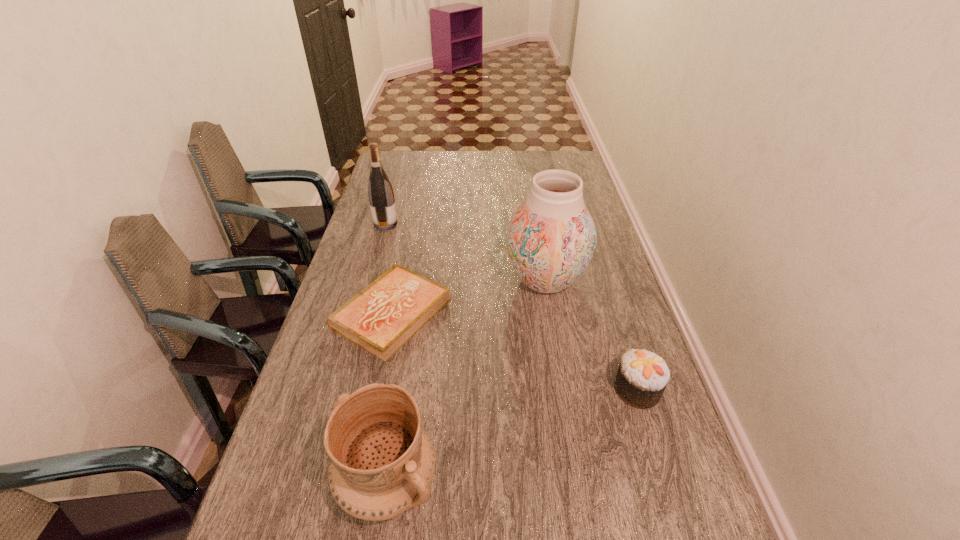
You are a GUI agent. You are given a task and a screenshot of the screen. Output one action in this format:
    pyautogui.click(x=<x>, y=<y>)
    Task: Click on the free point between the farthest object and the fourth tallest object
    Image resolution: width=960 pixels, height=540 pixels.
    Given the screenshot: What is the action you would take?
    pyautogui.click(x=512, y=307)

At what (x,y) coordinates should I click in order to perform the action: click on the fourth closest object to the vase. Please return your answer as a coordinate pair (x, y). The width and height of the screenshot is (960, 540). Looking at the image, I should click on (382, 462).

Identify which object is located as the nearest to the hardback book. Please provide its 2D coordinates. Your answer should be formatted as a tuple, i.e. [(x, y)], where the tuple contains the x and y coordinates of a point satisfying the conditions above.

[(551, 238)]

The height and width of the screenshot is (540, 960). I want to click on free space that satisfies the following two spatial constraints: 1. on the label of the wine bottle; 2. on the right side of the vase, so point(370,280).

You are a GUI agent. You are given a task and a screenshot of the screen. Output one action in this format:
    pyautogui.click(x=<x>, y=<y>)
    Task: Click on the vacant position in the image that satisfies the following two spatial constraints: 1. on the label of the wine bottle; 2. on the back side of the vase
    
    Given the screenshot: What is the action you would take?
    pyautogui.click(x=370, y=280)

You are a GUI agent. You are given a task and a screenshot of the screen. Output one action in this format:
    pyautogui.click(x=<x>, y=<y>)
    Task: Click on the free space that satisfies the following two spatial constraints: 1. on the label of the wine bottle; 2. on the right side of the hardback book
    The image size is (960, 540).
    Given the screenshot: What is the action you would take?
    pyautogui.click(x=360, y=314)

This screenshot has height=540, width=960. What are the coordinates of `vacant space that satisfies the following two spatial constraints: 1. on the label of the vase; 2. on the right side of the wine bottle` in the screenshot? It's located at (370, 280).

Identify the location of free space that satisfies the following two spatial constraints: 1. on the label of the wine bottle; 2. on the left side of the vase. (x=370, y=280).

Locate an element on the screen. Image resolution: width=960 pixels, height=540 pixels. free space in the image that satisfies the following two spatial constraints: 1. on the label of the farthest object; 2. on the back side of the vase is located at coordinates (370, 280).